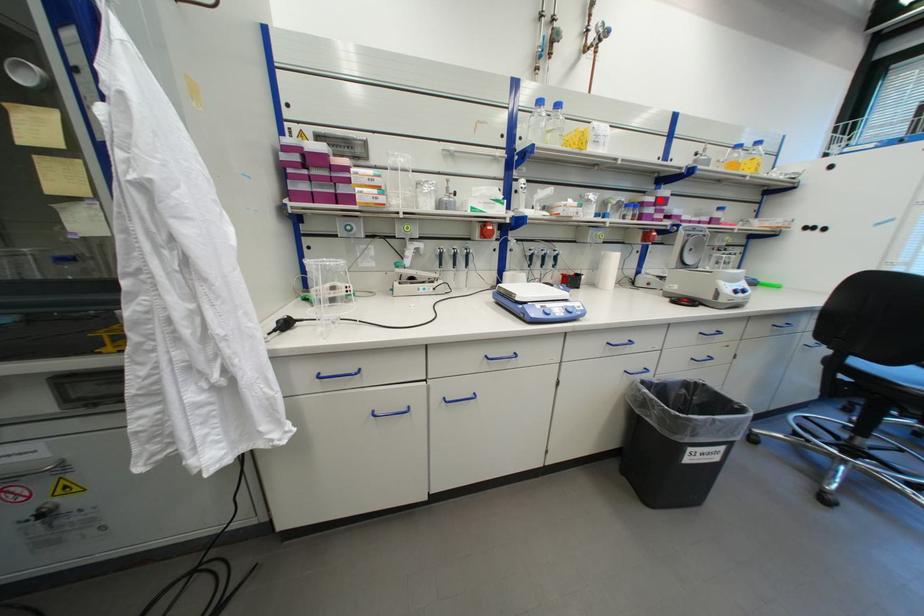
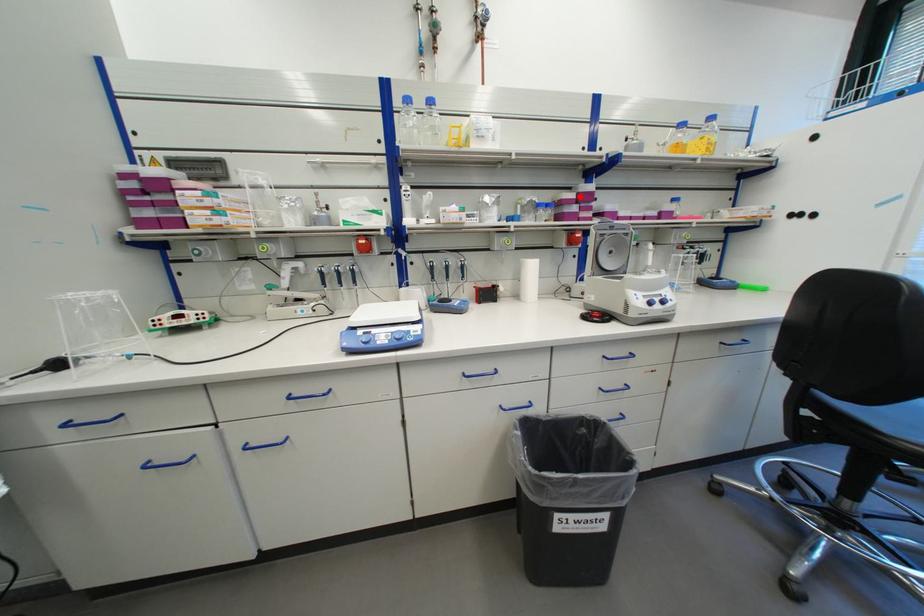
I am providing you with two images of the same scene from different viewpoints. A red point is marked on the first image and another point is marked on the second image. Are the points marked in image1 and image2 representing the same 3D position?

Yes